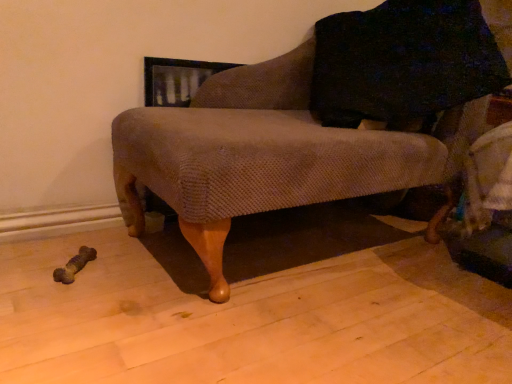
Locate an element on the screen. vacant area situated below knitted fabric chair at center (from a real-world perspective) is located at coordinates (300, 241).